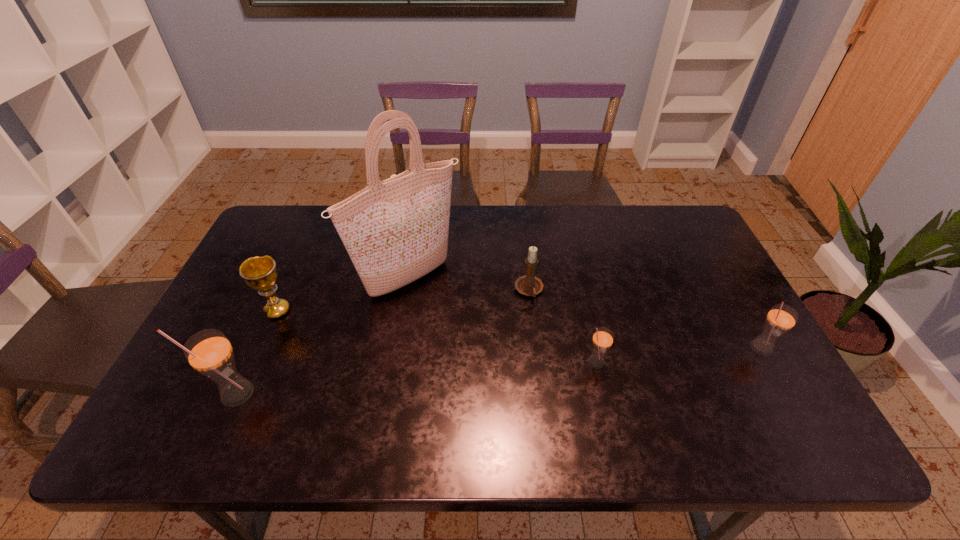
At what (x,y) coordinates should I click in order to perform the action: click on vacant region that satisfies the following two spatial constraints: 1. on the back side of the chalice; 2. on the right side of the tallest object. Please return your answer as a coordinate pair (x, y). Image resolution: width=960 pixels, height=540 pixels. Looking at the image, I should click on (291, 280).

This screenshot has height=540, width=960. Find the location of `vacant area in the image that satisfies the following two spatial constraints: 1. on the front side of the shopping bag; 2. on the left side of the rightmost straw`. vacant area in the image that satisfies the following two spatial constraints: 1. on the front side of the shopping bag; 2. on the left side of the rightmost straw is located at coordinates (397, 348).